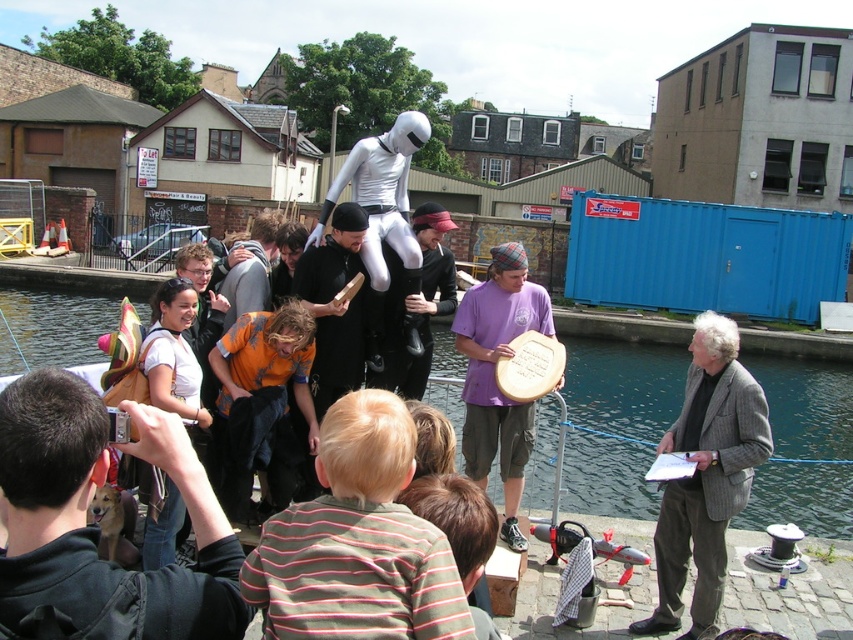
Question: Which point is closer to the camera taking this photo?

Choices:
 (A) (311, 257)
 (B) (473, 387)
 (C) (653, 627)

Answer: (C)

Question: Which point is farther from the camera taking this photo?

Choices:
 (A) (749, 368)
 (B) (498, 428)
 (C) (148, 598)

Answer: (A)

Question: Does gray woolen blazer at right have a lesser width compared to black matte shirt at center?

Choices:
 (A) yes
 (B) no

Answer: (A)

Question: Can you confirm if transparent water at center is wider than black matte shirt at center?

Choices:
 (A) no
 (B) yes

Answer: (B)

Question: Which is nearer to the black matte shirt at center?

Choices:
 (A) dark brown leather jacket at lower left
 (B) purple cotton shirt at center

Answer: (B)

Question: Is transparent water at center positioned before gray woolen blazer at right?

Choices:
 (A) no
 (B) yes

Answer: (A)